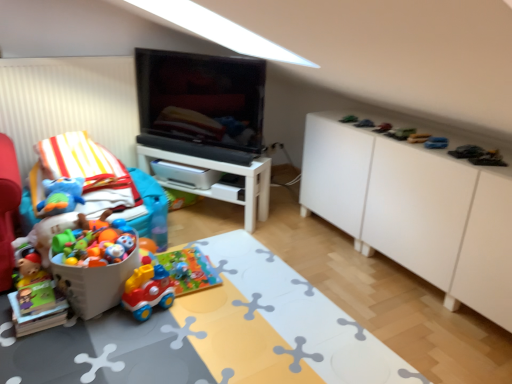
I want to click on vacant area that lies between rubber car at upper right, which is the fifth toy from left to right, and metallic silver toy car at upper right, which is the sixth toy in right-to-left order, so click(368, 125).